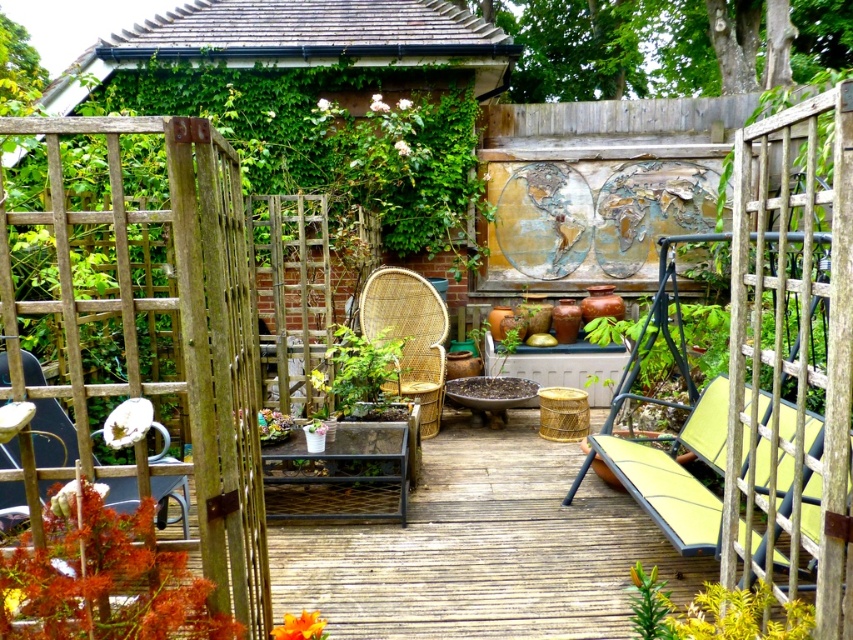
Is orange leafy plant at lower left bigger than metallic silver chair at left?

Actually, orange leafy plant at lower left might be smaller than metallic silver chair at left.

Identify the location of orange leafy plant at lower left. (107, 582).

Which is more to the right, woven rattan chair at center or green leafy plant at center?

woven rattan chair at center

Can you confirm if woven rattan chair at center is positioned below green leafy plant at center?

No.

Measure the distance between point (x=395, y=385) and camera.

5.51 meters

Where is `woven rattan chair at center`? Image resolution: width=853 pixels, height=640 pixels. woven rattan chair at center is located at coordinates (409, 336).

Is point (48, 524) positioned before point (387, 310)?

Yes.

Is point (114, 618) in front of point (418, 308)?

Yes, point (114, 618) is in front of point (418, 308).

You are a GUI agent. You are given a task and a screenshot of the screen. Output one action in this format:
    pyautogui.click(x=<x>, y=<y>)
    Task: Click on the orange leafy plant at lower left
    The height and width of the screenshot is (640, 853).
    Given the screenshot: What is the action you would take?
    pyautogui.click(x=107, y=582)